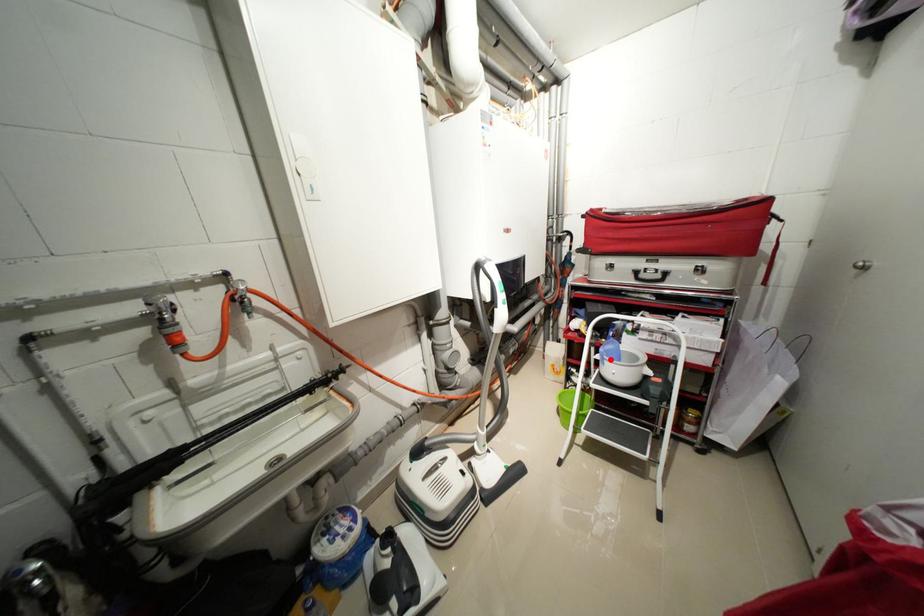
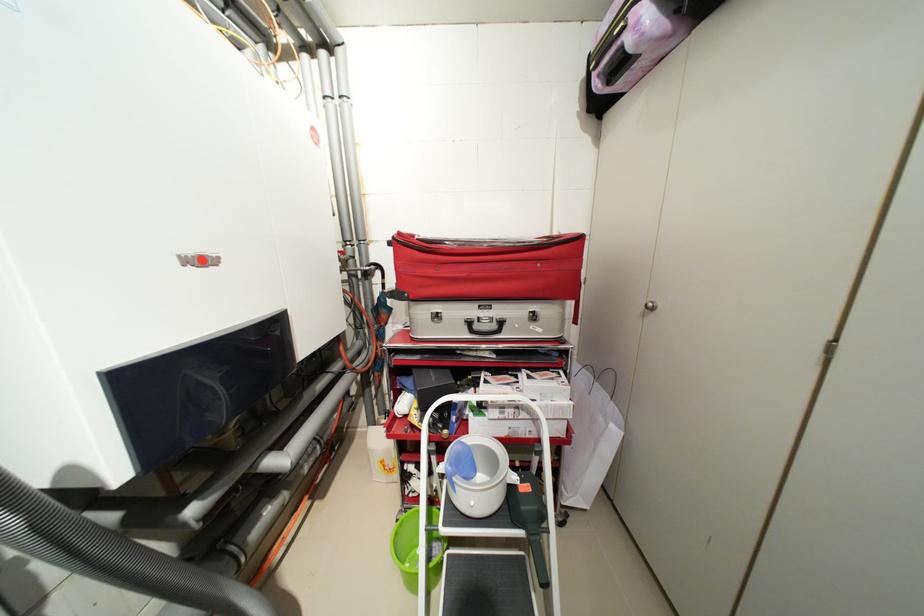
Question: I am providing you with two images of the same scene from different viewpoints. In image1, a red point is highlighted. Considering the same 3D point in image2, which of the following is correct?

Choices:
 (A) It is closer
 (B) It is farther

Answer: (B)